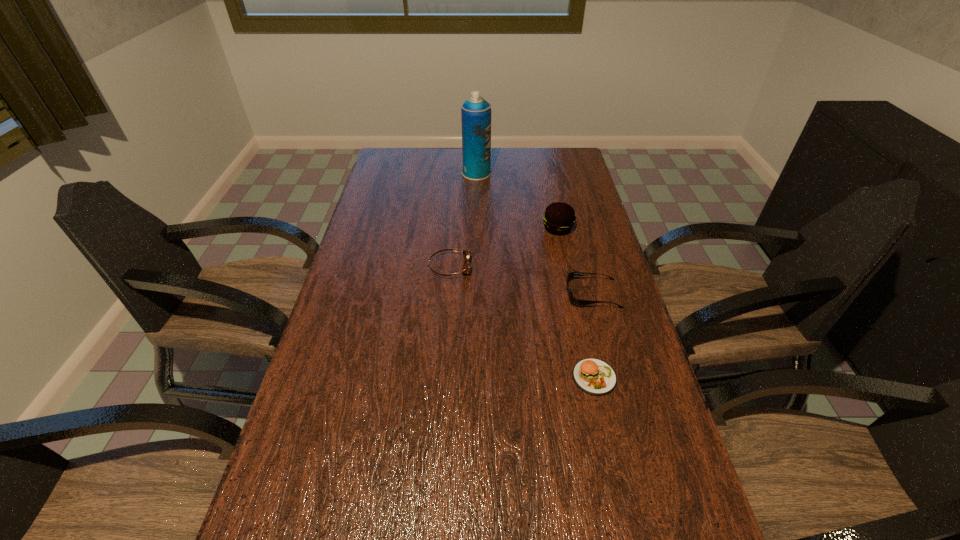
Locate an element on the screen. Image resolution: width=960 pixels, height=540 pixels. free point that satisfies the following two spatial constraints: 1. on the front side of the taller patty; 2. through the lenses of the goggles is located at coordinates pos(565,267).

Where is `free space that satisfies the following two spatial constraints: 1. on the front side of the nearer patty; 2. on the left side of the tallest object`? free space that satisfies the following two spatial constraints: 1. on the front side of the nearer patty; 2. on the left side of the tallest object is located at coordinates (474, 377).

Locate an element on the screen. The height and width of the screenshot is (540, 960). free region that satisfies the following two spatial constraints: 1. on the front side of the second tallest object; 2. on the right side of the nearer patty is located at coordinates (589, 377).

At what (x,y) coordinates should I click in order to perform the action: click on free location that satisfies the following two spatial constraints: 1. on the front side of the taller patty; 2. on the right side of the shorter patty. Please return your answer as a coordinate pair (x, y). Image resolution: width=960 pixels, height=540 pixels. Looking at the image, I should click on (589, 377).